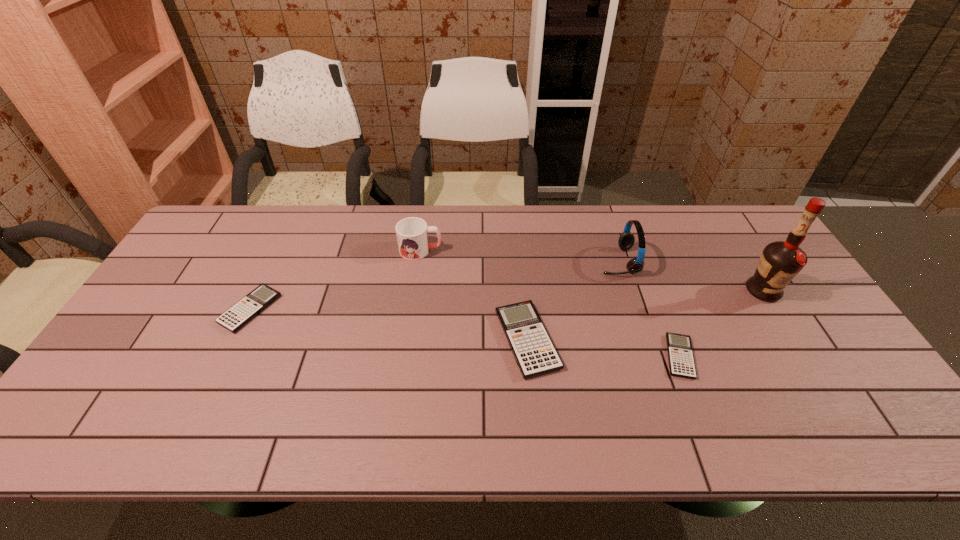
In order to click on location for an additional calculator to make spacing equal in this screenshot , I will do `click(384, 324)`.